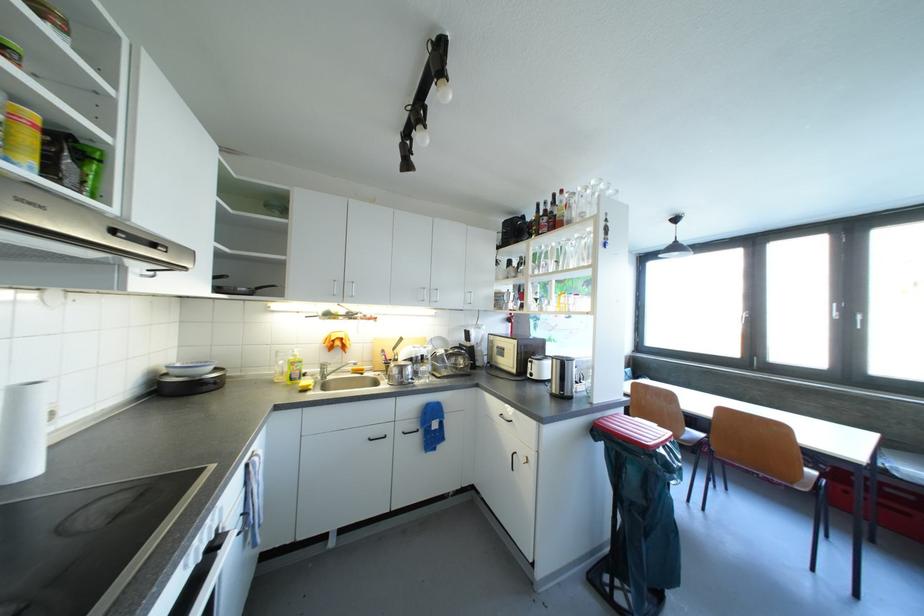
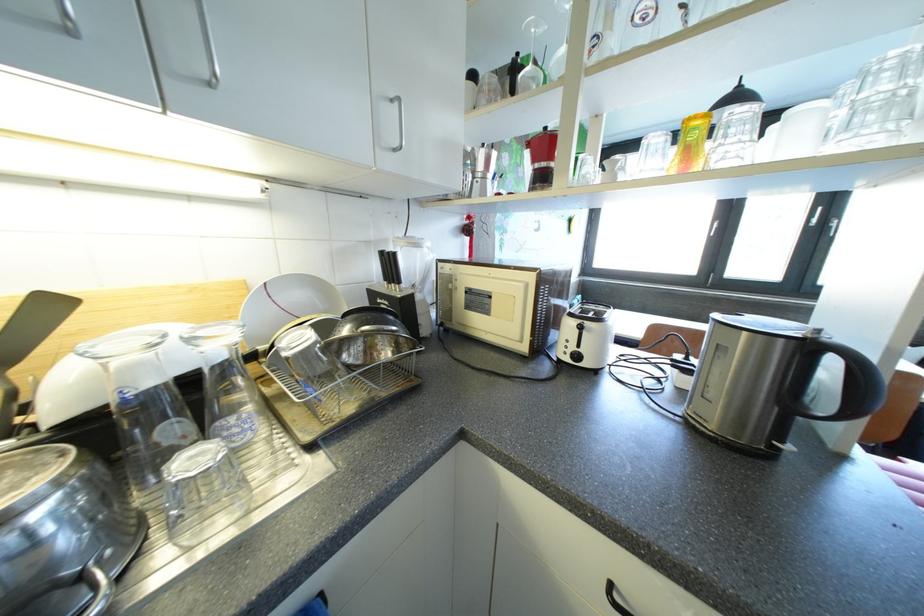
Find the pixel in the second image that matches (x=533, y=378) in the first image.

(573, 362)